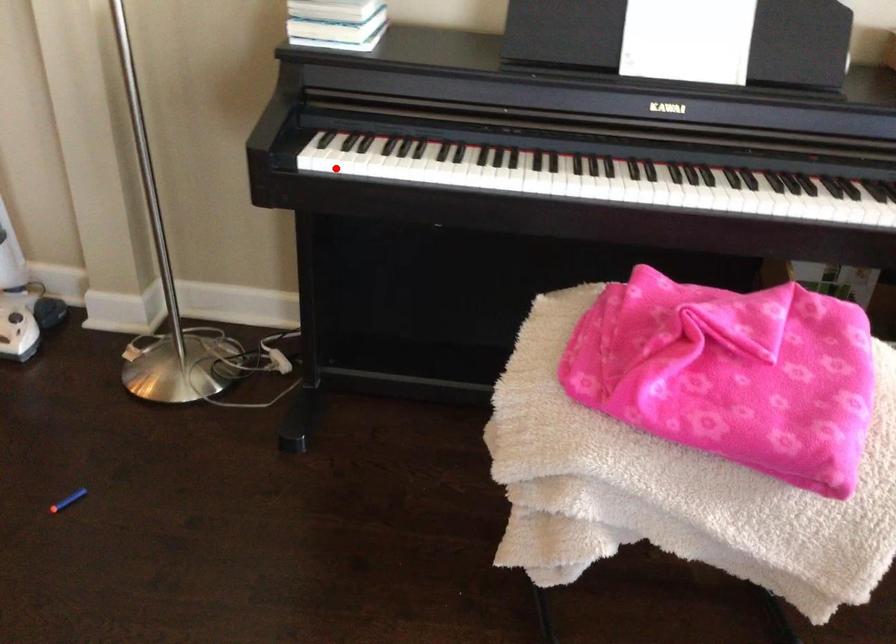
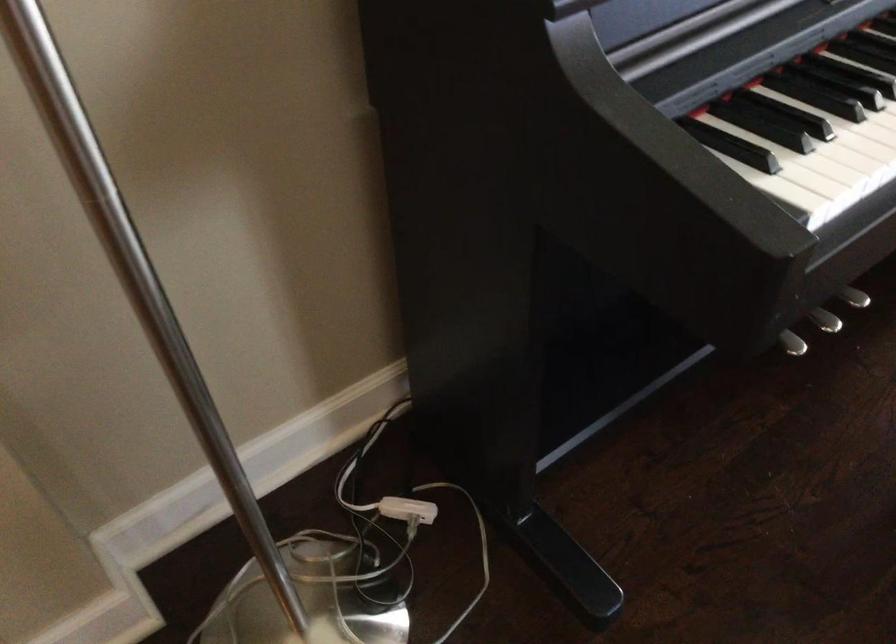
Question: I am providing you with two images of the same scene from different viewpoints. A red point is marked on the first image. Can you still see the location of the red point in image 2?

Choices:
 (A) Yes
 (B) No

Answer: (A)